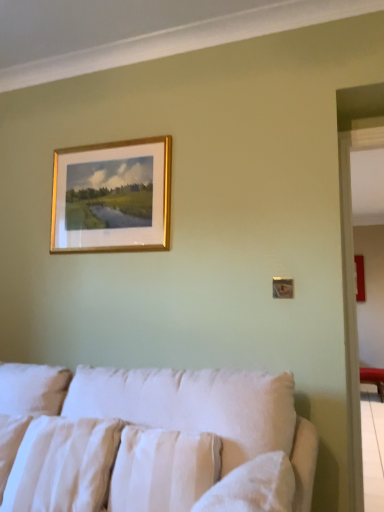
Question: Considering the relative positions of white cotton pillow at lower left, which is the 2th pillow in right-to-left order, and gold-framed painting at upper center in the image provided, is white cotton pillow at lower left, which is the 2th pillow in right-to-left order, to the left of gold-framed painting at upper center from the viewer's perspective?

Choices:
 (A) no
 (B) yes

Answer: (B)

Question: Is white cotton pillow at lower left, acting as the 1th pillow starting from the left, not within gold-framed painting at upper center?

Choices:
 (A) no
 (B) yes

Answer: (B)

Question: Is white cotton pillow at lower left, acting as the 1th pillow starting from the left, further to the viewer compared to gold-framed painting at upper center?

Choices:
 (A) no
 (B) yes

Answer: (A)

Question: Considering the relative sizes of white cotton pillow at lower left, acting as the 1th pillow starting from the left, and gold-framed painting at upper center in the image provided, is white cotton pillow at lower left, acting as the 1th pillow starting from the left, thinner than gold-framed painting at upper center?

Choices:
 (A) yes
 (B) no

Answer: (B)

Question: Is the surface of white cotton pillow at lower left, acting as the 1th pillow starting from the left, in direct contact with gold-framed painting at upper center?

Choices:
 (A) no
 (B) yes

Answer: (A)

Question: Which is correct: white textured pillow at lower center, arranged as the 1th pillow when viewed from the right, is inside white fabric couch at lower center, or outside of it?

Choices:
 (A) outside
 (B) inside

Answer: (B)

Question: From the image's perspective, is white textured pillow at lower center, the 2th pillow in the left-to-right sequence, located above or below white fabric couch at lower center?

Choices:
 (A) above
 (B) below

Answer: (A)

Question: Is point (122, 482) closer or farther from the camera than point (205, 422)?

Choices:
 (A) farther
 (B) closer

Answer: (B)

Question: Looking at the image, does white textured pillow at lower center, the 2th pillow in the left-to-right sequence, seem bigger or smaller compared to white fabric couch at lower center?

Choices:
 (A) big
 (B) small

Answer: (B)

Question: Is point (51, 461) closer or farther from the camera than point (127, 159)?

Choices:
 (A) farther
 (B) closer

Answer: (B)

Question: Relative to gold-framed painting at upper center, is white cotton pillow at lower left, acting as the 1th pillow starting from the left, in front or behind?

Choices:
 (A) front
 (B) behind

Answer: (A)

Question: Is white cotton pillow at lower left, acting as the 1th pillow starting from the left, wider or thinner than gold-framed painting at upper center?

Choices:
 (A) wide
 (B) thin

Answer: (A)

Question: In terms of height, does white cotton pillow at lower left, which is the 2th pillow in right-to-left order, look taller or shorter compared to gold-framed painting at upper center?

Choices:
 (A) short
 (B) tall

Answer: (A)

Question: Is point (54, 505) closer or farther from the camera than point (292, 379)?

Choices:
 (A) closer
 (B) farther

Answer: (A)

Question: Looking at their shapes, would you say white cotton pillow at lower left, acting as the 1th pillow starting from the left, is wider or thinner than white fabric couch at lower center?

Choices:
 (A) thin
 (B) wide

Answer: (A)